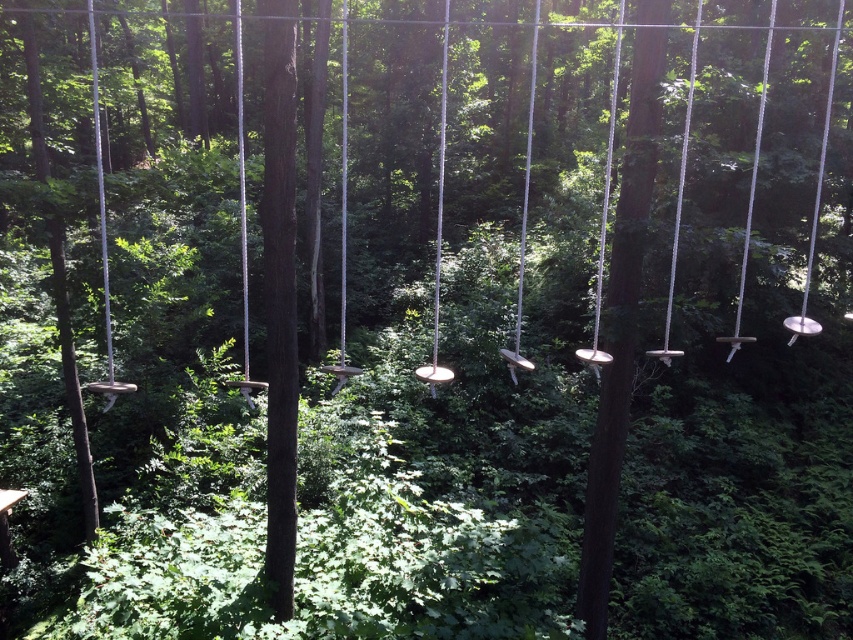
Question: Among these points, which one is farthest from the camera?

Choices:
 (A) (107, 394)
 (B) (439, 150)

Answer: (B)

Question: Which point appears closest to the camera in this image?

Choices:
 (A) (102, 252)
 (B) (437, 208)

Answer: (A)

Question: Does metallic silver swing at left have a lesser width compared to metallic silver swing at center?

Choices:
 (A) no
 (B) yes

Answer: (A)

Question: Is metallic silver swing at left closer to camera compared to metallic silver swing at center?

Choices:
 (A) no
 (B) yes

Answer: (B)

Question: Can you confirm if metallic silver swing at left is smaller than metallic silver swing at center?

Choices:
 (A) yes
 (B) no

Answer: (B)